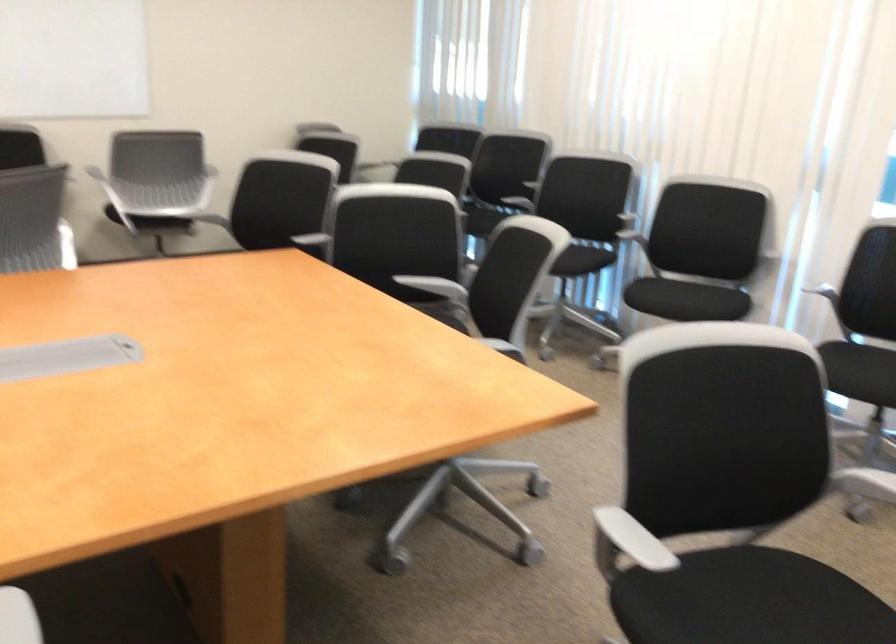
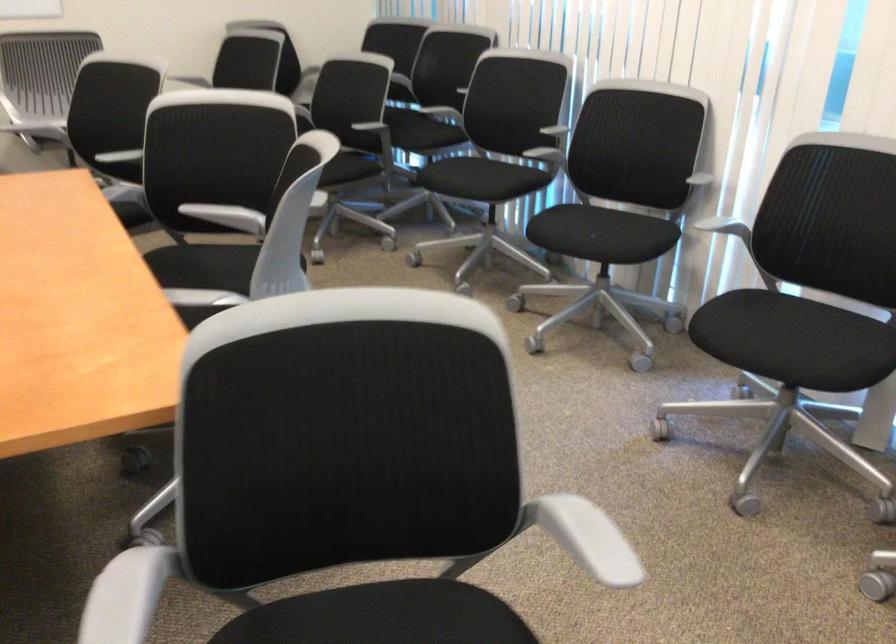
In the second image, find the point that corresponds to pixel 613 223 in the first image.

(543, 146)